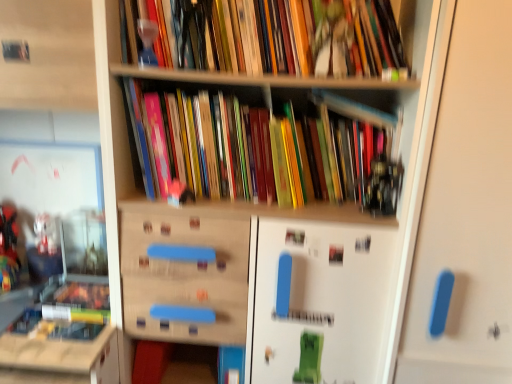
Question: Considering their positions, is wooden bookshelf at left located in front of or behind white matte door at right?

Choices:
 (A) behind
 (B) front

Answer: (B)

Question: Do you think wooden bookshelf at left is within white matte door at right, or outside of it?

Choices:
 (A) outside
 (B) inside

Answer: (A)

Question: Estimate the real-world distances between objects in this image. Which object is farther from the multicolored paperbacks at center, the 2th book in the top-to-bottom sequence?

Choices:
 (A) hardcover books at upper center, which is the first book in top-to-bottom order
 (B) wooden bookshelf at left
 (C) white matte door at right
 (D) translucent glass trophy at upper center

Answer: (B)

Question: Estimate the real-world distances between objects in this image. Which object is farther from the translucent glass trophy at upper center?

Choices:
 (A) wooden bookshelf at left
 (B) hardcover books at upper center, which is the 2th book from bottom to top
 (C) white matte door at right
 (D) multicolored paperbacks at center, the first book in the bottom-to-top sequence

Answer: (C)